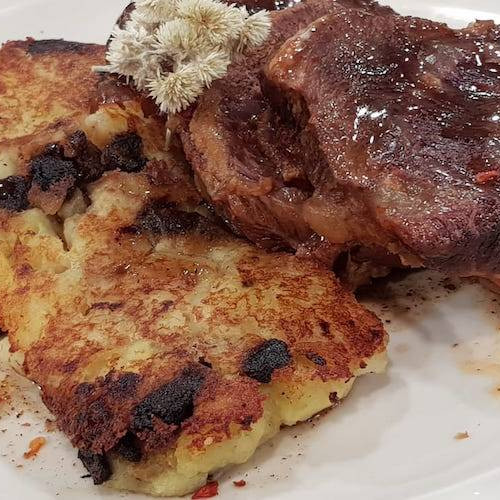
In order to click on mat in this screenshot , I will do `click(403, 427)`.